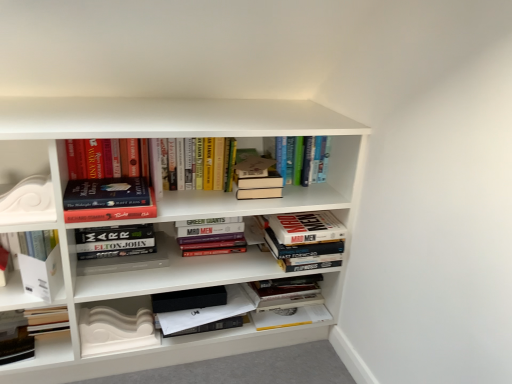
Question: Does white glossy decorative element at left have a smaller size compared to hardcover book at center, the fifth book in the left-to-right sequence?

Choices:
 (A) yes
 (B) no

Answer: (A)

Question: Could you tell me if white glossy decorative element at left is facing hardcover book at center, which appears as the 2th book when viewed from the right?

Choices:
 (A) yes
 (B) no

Answer: (B)

Question: Is white glossy decorative element at left thinner than hardcover book at center, which appears as the 2th book when viewed from the right?

Choices:
 (A) yes
 (B) no

Answer: (A)

Question: Is white glossy decorative element at left further to the viewer compared to hardcover book at center, the fifth book in the left-to-right sequence?

Choices:
 (A) no
 (B) yes

Answer: (A)

Question: Is white glossy decorative element at left at the right side of hardcover book at center, the fifth book in the left-to-right sequence?

Choices:
 (A) no
 (B) yes

Answer: (A)

Question: From the image's perspective, relative to hardcover book at upper center, which is counted as the first book, starting from the right, is hardcover book at center, the fifth book in the left-to-right sequence, above or below?

Choices:
 (A) below
 (B) above

Answer: (A)

Question: In the image, is hardcover book at center, which appears as the 2th book when viewed from the right, positioned in front of or behind hardcover book at upper center, which is counted as the first book, starting from the right?

Choices:
 (A) front
 (B) behind

Answer: (A)

Question: In terms of size, does hardcover book at center, the fifth book in the left-to-right sequence, appear bigger or smaller than hardcover book at upper center, which is counted as the first book, starting from the right?

Choices:
 (A) big
 (B) small

Answer: (A)

Question: Considering the relative positions of hardcover book at center, which appears as the 2th book when viewed from the right, and hardcover book at upper center, the sixth book from the left, in the image provided, is hardcover book at center, which appears as the 2th book when viewed from the right, to the left or to the right of hardcover book at upper center, the sixth book from the left,?

Choices:
 (A) right
 (B) left

Answer: (B)

Question: In the image, is hardcover books at center, arranged as the third book when viewed from the left, positioned in front of or behind hardcover book at center, acting as the fourth book starting from the left?

Choices:
 (A) front
 (B) behind

Answer: (B)

Question: From a real-world perspective, is hardcover books at center, which is the 4th book in right-to-left order, physically located above or below hardcover book at center, acting as the fourth book starting from the left?

Choices:
 (A) above
 (B) below

Answer: (B)

Question: Is point (194, 243) closer or farther from the camera than point (247, 195)?

Choices:
 (A) closer
 (B) farther

Answer: (B)

Question: Would you say hardcover books at center, arranged as the third book when viewed from the left, is to the left or to the right of hardcover book at center, the 3th book positioned from the right, in the picture?

Choices:
 (A) left
 (B) right

Answer: (A)

Question: Considering the positions of white glossy decorative element at left and hardcover book at center, which appears as the 2th book when viewed from the right, in the image, is white glossy decorative element at left wider or thinner than hardcover book at center, which appears as the 2th book when viewed from the right,?

Choices:
 (A) wide
 (B) thin

Answer: (B)

Question: Considering the positions of white glossy decorative element at left and hardcover book at center, which appears as the 2th book when viewed from the right, in the image, is white glossy decorative element at left taller or shorter than hardcover book at center, which appears as the 2th book when viewed from the right,?

Choices:
 (A) tall
 (B) short

Answer: (B)